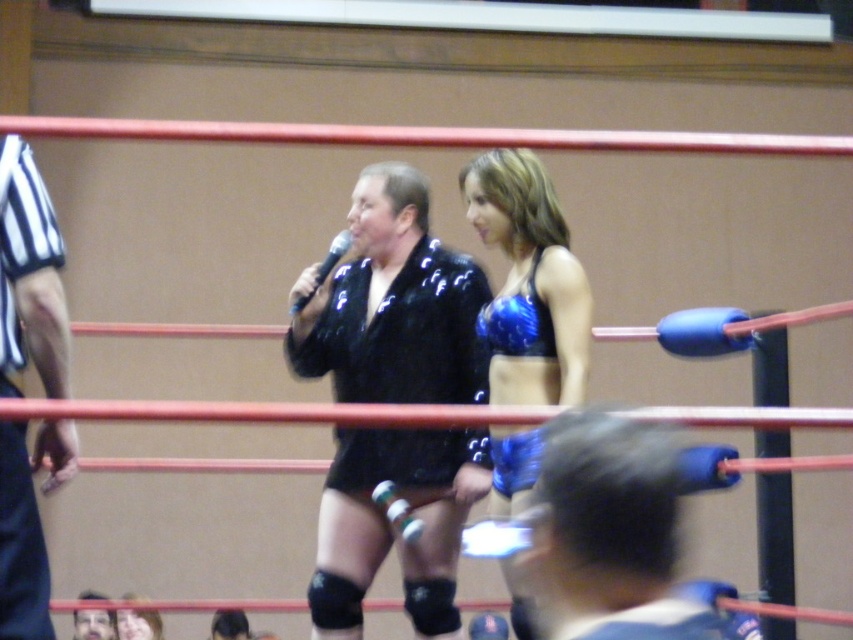
Question: Can you confirm if blue shiny shorts at lower right is smaller than striped fabric shirt at left?

Choices:
 (A) yes
 (B) no

Answer: (A)

Question: Which of the following is the closest to the observer?

Choices:
 (A) (492, 500)
 (B) (77, 611)
 (C) (3, 506)
 (D) (157, 614)

Answer: (C)

Question: Which point is closer to the camera taking this photo?

Choices:
 (A) (22, 161)
 (B) (296, 307)

Answer: (A)

Question: Can you confirm if blue shiny shorts at lower right is thinner than shiny blue bikini top at center?

Choices:
 (A) no
 (B) yes

Answer: (A)

Question: Which object is closer to the camera taking this photo?

Choices:
 (A) smooth black suit at center
 (B) blue shiny shorts at lower right
 (C) striped fabric shirt at left
 (D) shiny black jacket at center

Answer: (B)

Question: Is smooth black suit at center smaller than black plastic microphone at center?

Choices:
 (A) no
 (B) yes

Answer: (A)